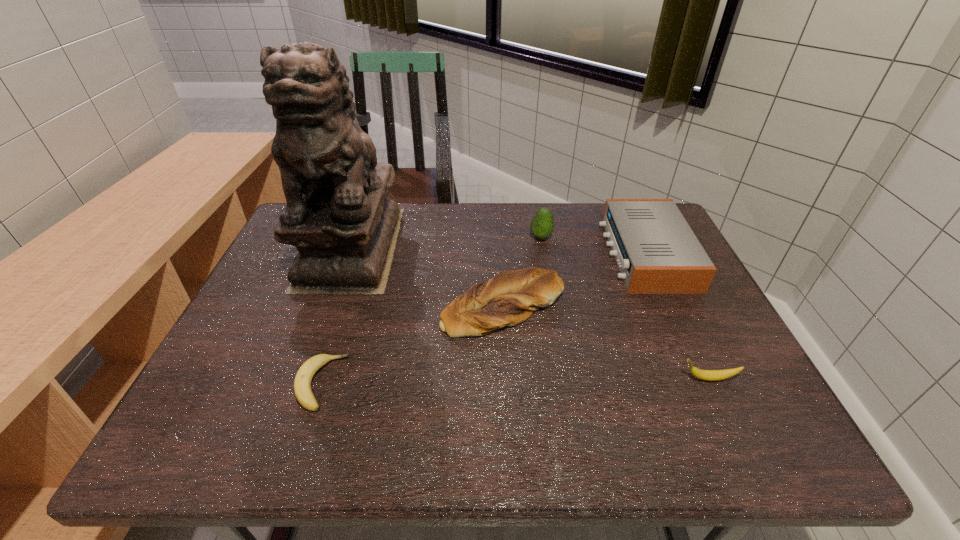
The image size is (960, 540). In order to click on radio receiver present at the far edge in this screenshot , I will do `click(657, 252)`.

Where is `object that is at the left edge`? The image size is (960, 540). object that is at the left edge is located at coordinates (338, 215).

Locate an element on the screen. radio receiver that is at the right edge is located at coordinates (657, 252).

Locate an element on the screen. banana located in the right edge section of the desktop is located at coordinates (708, 375).

Locate an element on the screen. object that is positioned at the far left corner is located at coordinates (338, 215).

This screenshot has height=540, width=960. I want to click on object that is at the far right corner, so click(657, 252).

What are the coordinates of `vacant space at the far edge of the desktop` in the screenshot? It's located at (449, 210).

I want to click on free point at the near edge, so click(547, 416).

I want to click on vacant space at the left edge of the desktop, so click(x=240, y=313).

In the image, there is a desktop. At what (x,y) coordinates should I click in order to perform the action: click on vacant region at the right edge. Please return your answer as a coordinate pair (x, y). Looking at the image, I should click on (705, 404).